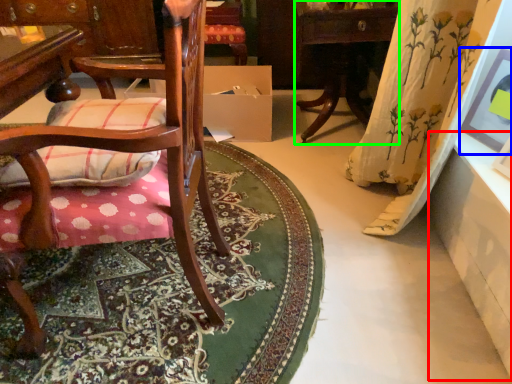
Question: Which object is the farthest from table (highlighted by a red box)? Choose among these: picture frame (highlighted by a blue box) or table (highlighted by a green box).

Choices:
 (A) picture frame
 (B) table

Answer: (B)